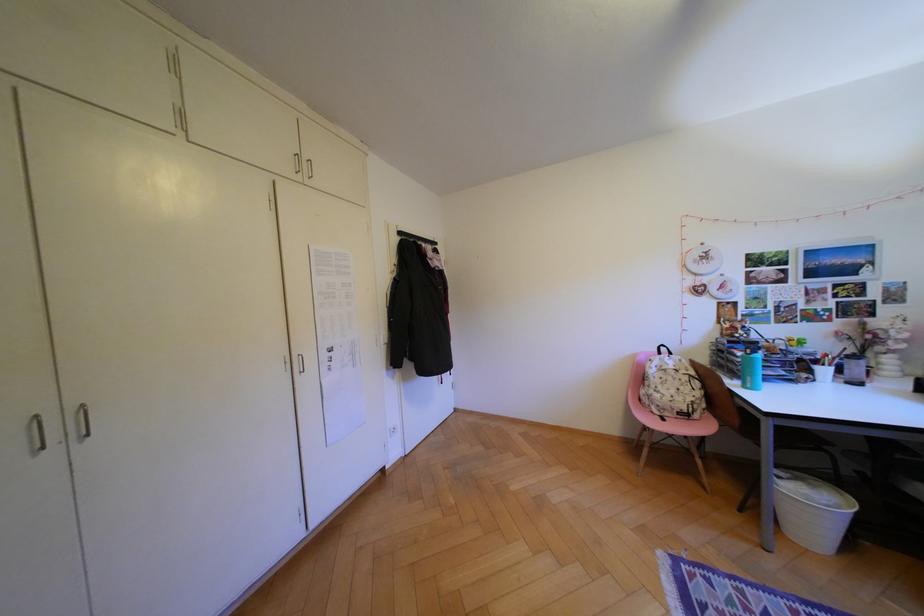
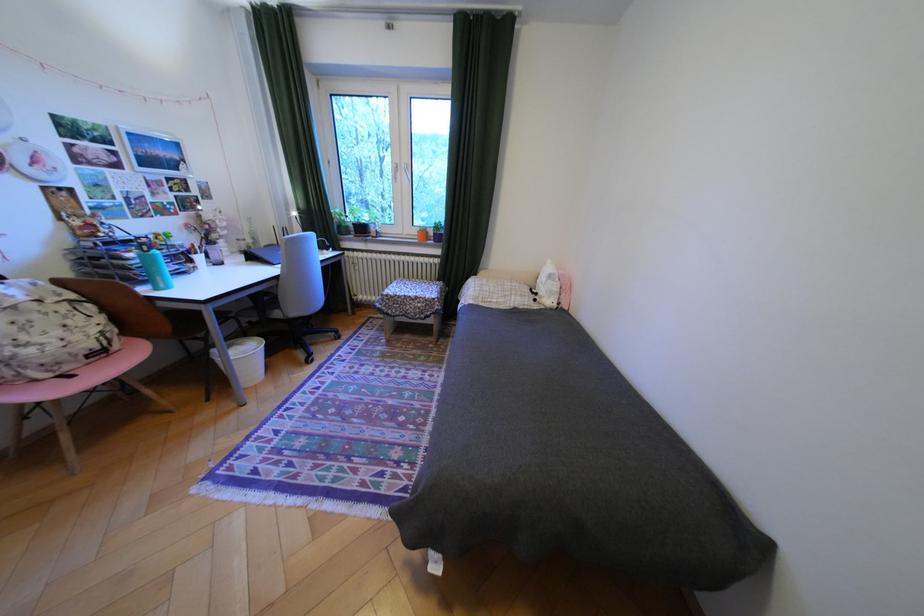
Find the pixel in the second image that matches point (682, 379) in the first image.

(49, 317)